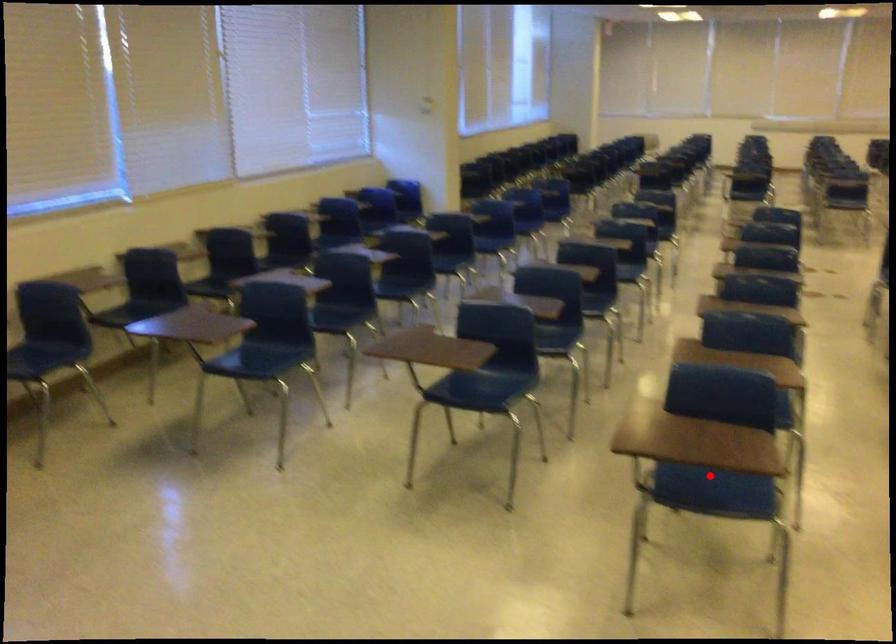
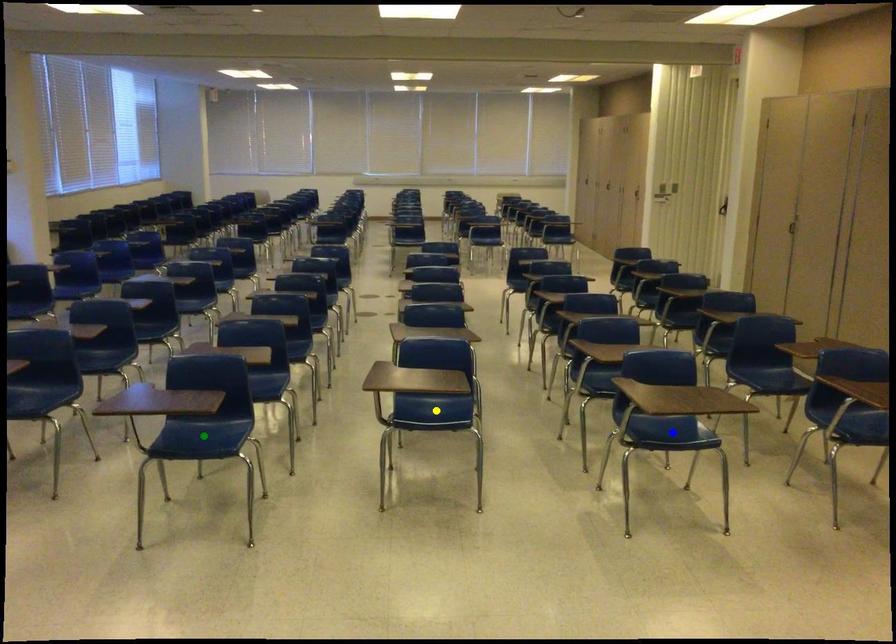
Question: I am providing you with two images of the same scene from different viewpoints. A red point is marked on the first image. You are given multiple points on the second image. Which point in image 2 represents the same 3d spot as the red point in image 1?

Choices:
 (A) blue point
 (B) green point
 (C) yellow point

Answer: (B)